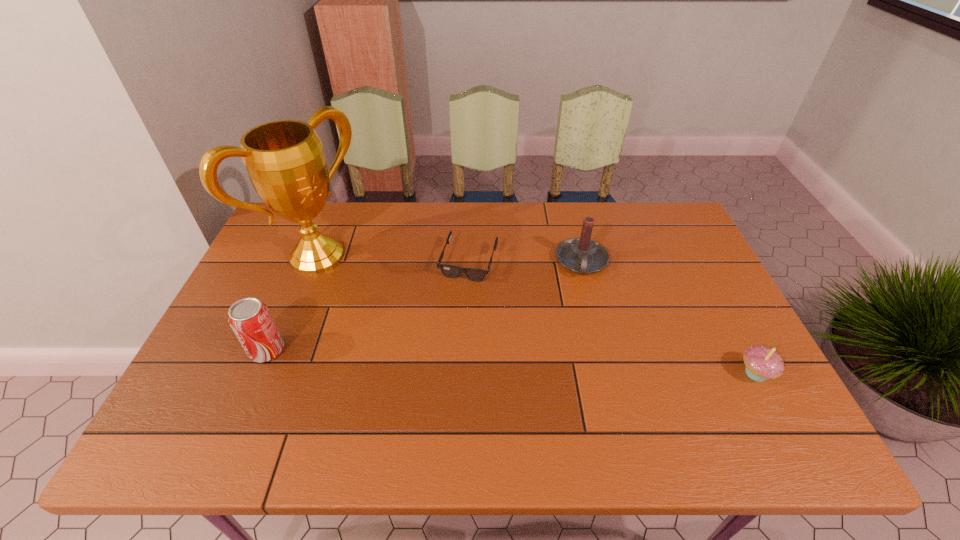
The image size is (960, 540). Identify the location of vacant position at the near right corner of the desktop. (704, 376).

Identify the location of empty space that is in between the second object from right to left and the shortest object. (525, 261).

You are a GUI agent. You are given a task and a screenshot of the screen. Output one action in this format:
    pyautogui.click(x=<x>, y=<y>)
    Task: Click on the empty location between the soda can and the award
    
    Given the screenshot: What is the action you would take?
    pyautogui.click(x=292, y=303)

The width and height of the screenshot is (960, 540). Find the location of `free space between the award and the rightmost object`. free space between the award and the rightmost object is located at coordinates tap(537, 315).

Identify the location of vacant area between the cupcake and the shortest object. The image size is (960, 540). click(612, 318).

You are a GUI agent. You are given a task and a screenshot of the screen. Output one action in this format:
    pyautogui.click(x=<x>, y=<y>)
    Task: Click on the free space that is in between the sunglasses and the soda can
    Image resolution: width=960 pixels, height=540 pixels.
    Given the screenshot: What is the action you would take?
    pyautogui.click(x=368, y=306)

Where is `free space between the tallest object and the soda can`? The height and width of the screenshot is (540, 960). free space between the tallest object and the soda can is located at coordinates (292, 303).

The height and width of the screenshot is (540, 960). In order to click on vacant space that is in between the shortest object and the fourth object from left to right in this screenshot , I will do `click(525, 261)`.

Locate an element on the screen. The height and width of the screenshot is (540, 960). empty space between the soda can and the third object from left to right is located at coordinates (368, 306).

Image resolution: width=960 pixels, height=540 pixels. I want to click on free space between the soda can and the candle, so click(x=424, y=306).